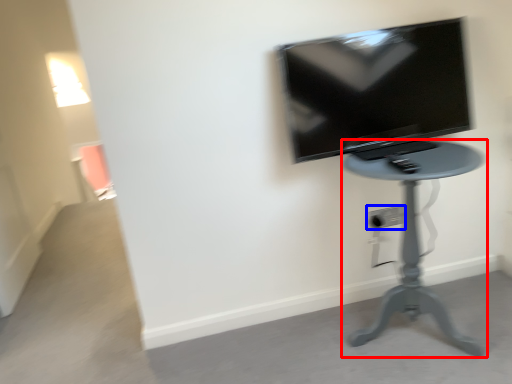
Question: Which object is closer to the camera taking this photo, furniture (highlighted by a red box) or electric outlet (highlighted by a blue box)?

Choices:
 (A) furniture
 (B) electric outlet

Answer: (A)